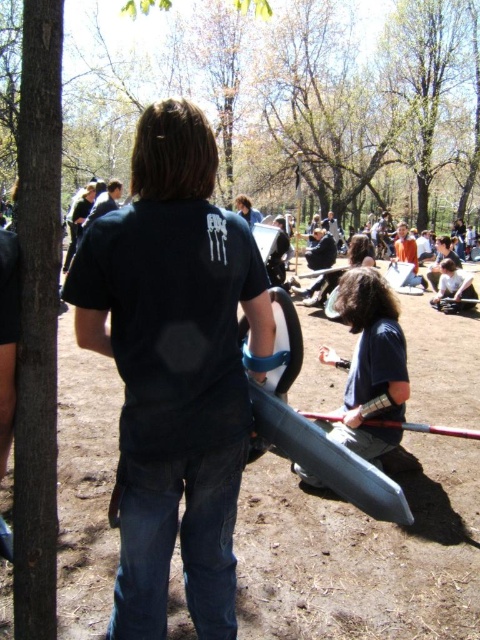
You are planning to take a photo of the dark blue shirt at lower center and the matte black shirt at center in the park scene. Since you want both subjects to appear in the same frame, will the height difference between them affect the composition? Please explain based on their positions.

The dark blue shirt at lower center is taller than the matte black shirt at center, so their height difference may require adjusting the camera angle or framing to ensure both are fully visible in the photo.

You are a bird flying over a park and need to land on a tree. You see the brown bark tree at upper center and the green leafy tree at upper center. Which tree is closer to the ground?

The brown bark tree at upper center is closer to the ground because it is positioned below the green leafy tree at upper center.

You are trying to throw a ball from the point at (172, 397) to another point that is 1.59 meters away. What is the minimum distance you need to throw the ball?

The minimum distance you need to throw the ball is 1.59 meters because they are exactly 1.59 meters apart.